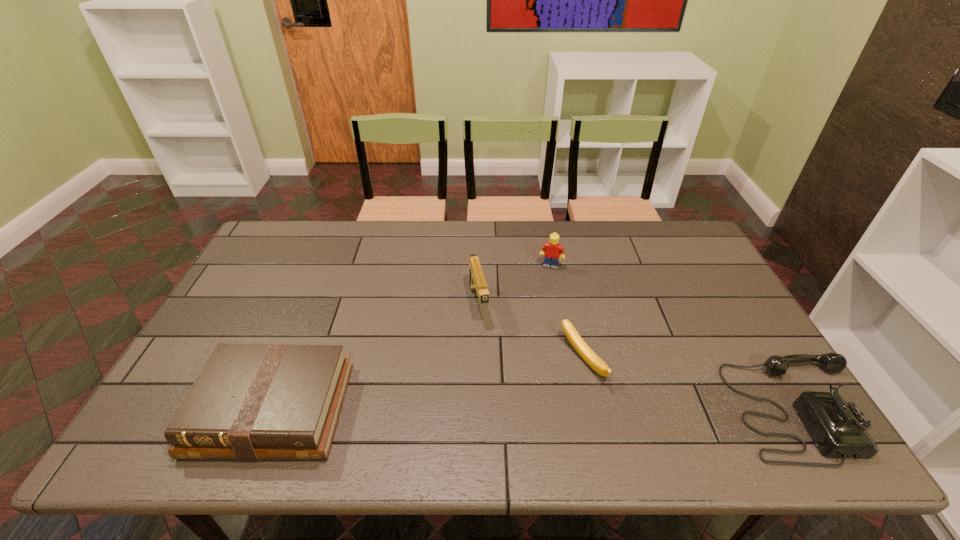
The image size is (960, 540). I want to click on free space on the desktop that is between the Bible and the telephone and is positioned at the stem of the shortest object, so click(x=493, y=409).

At what (x,y) coordinates should I click in order to perform the action: click on free space on the desktop that is between the second shortest object and the telephone and is positioned at the barrel of the second object from left to right. Please return your answer as a coordinate pair (x, y). The height and width of the screenshot is (540, 960). Looking at the image, I should click on pyautogui.click(x=507, y=409).

Where is `free space on the desktop that is between the fourth tallest object and the telephone and is positioned on the front-facing side of the Lego`? free space on the desktop that is between the fourth tallest object and the telephone and is positioned on the front-facing side of the Lego is located at coordinates pyautogui.click(x=513, y=409).